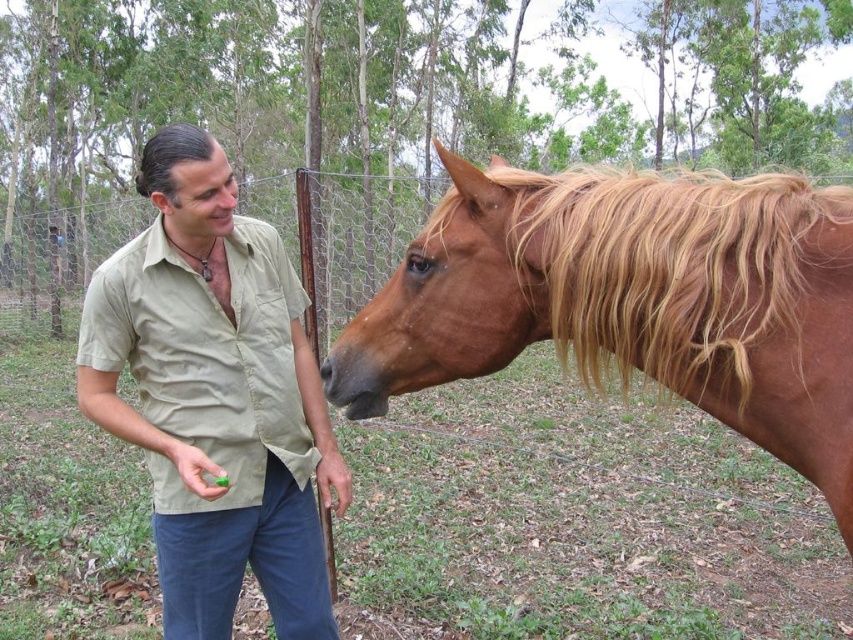
You are a photographer setting up a tripod to capture the scene where the brown glossy horse at right and the matte khaki shirt at center are positioned. Based on their heights, which object should you adjust the camera angle to focus on first without changing the tripod height?

The brown glossy horse at right is shorter than the matte khaki shirt at center, so you should adjust the camera angle to focus on the brown glossy horse at right first since it is lower in height.

You are standing in a rural area and see a man and a horse in the scene. There is a point at coordinates point (143, 282) that is 6.57 feet away from you. If you want to reach that point, which direction should you move relative to the man and the horse?

The point at coordinates point (143, 282) is 6.57 feet away from you. Since the man is on the left side and the horse is on the right side of the frame, you should move towards the area between them to reach the point.

You are an observer standing in front of the scene. You notice the matte khaki shirt at center and the golden silky mane at upper right. Which object appears bigger in the image?

The matte khaki shirt at center appears bigger than the golden silky mane at upper right because it has a larger size compared to it.